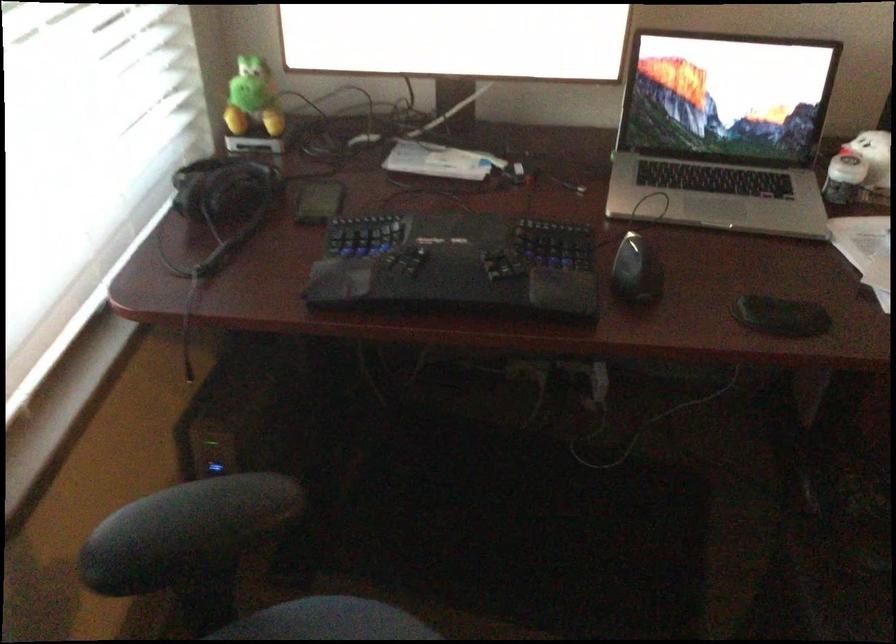
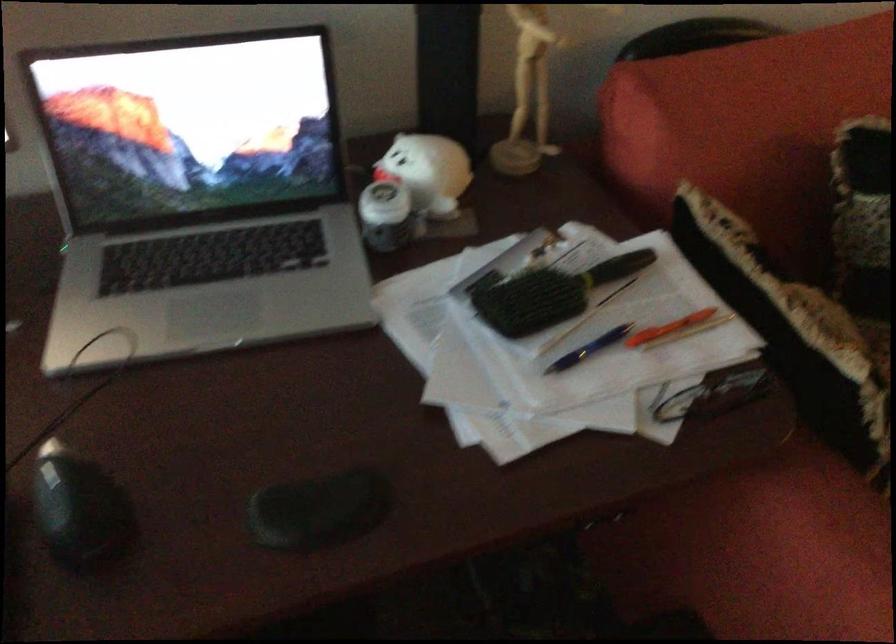
In the second image, find the point that corresponds to (634,263) in the first image.

(80, 511)